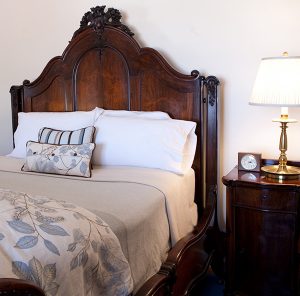
What are the coordinates of `blanket` in the screenshot? It's located at (68, 251).